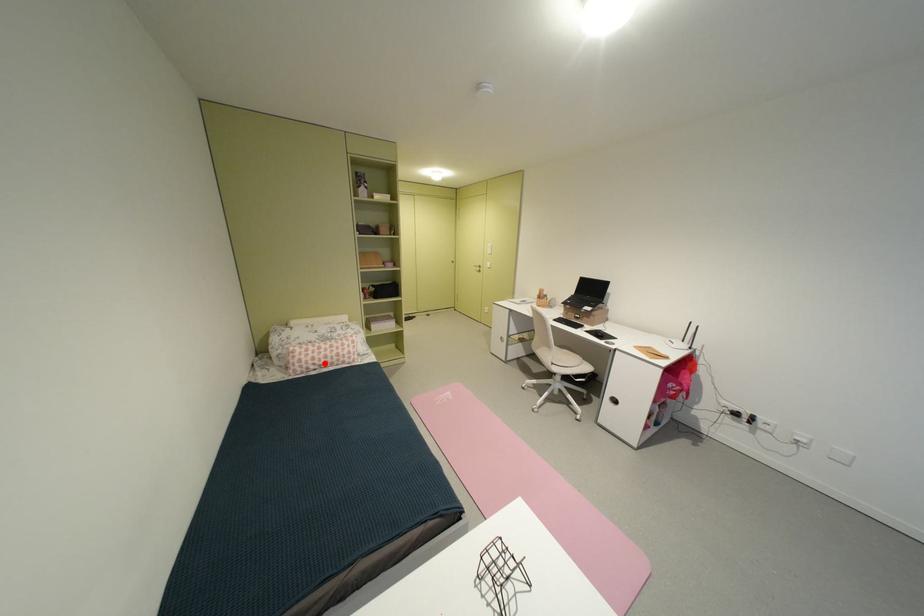
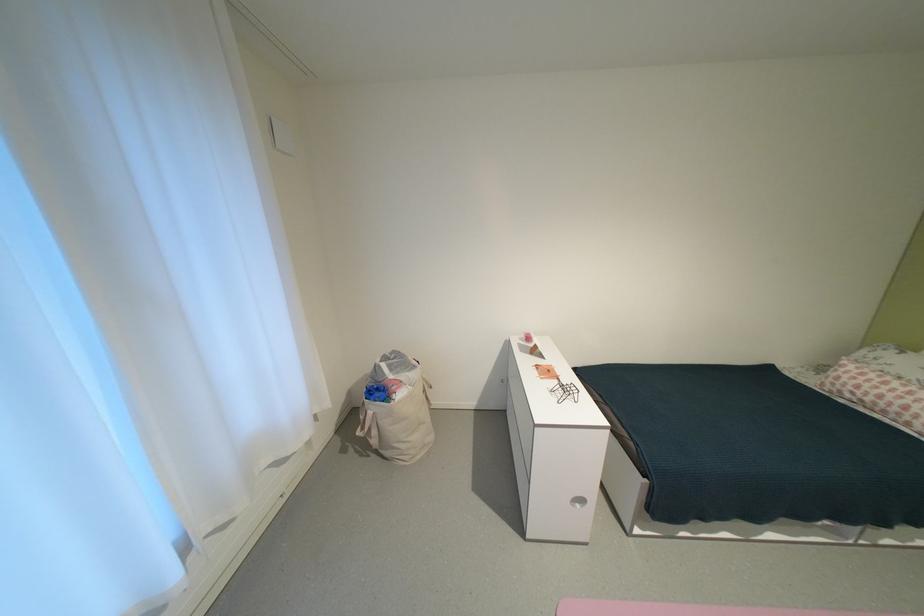
Find the pixel in the second image that matches the highlighted location in the first image.

(867, 392)